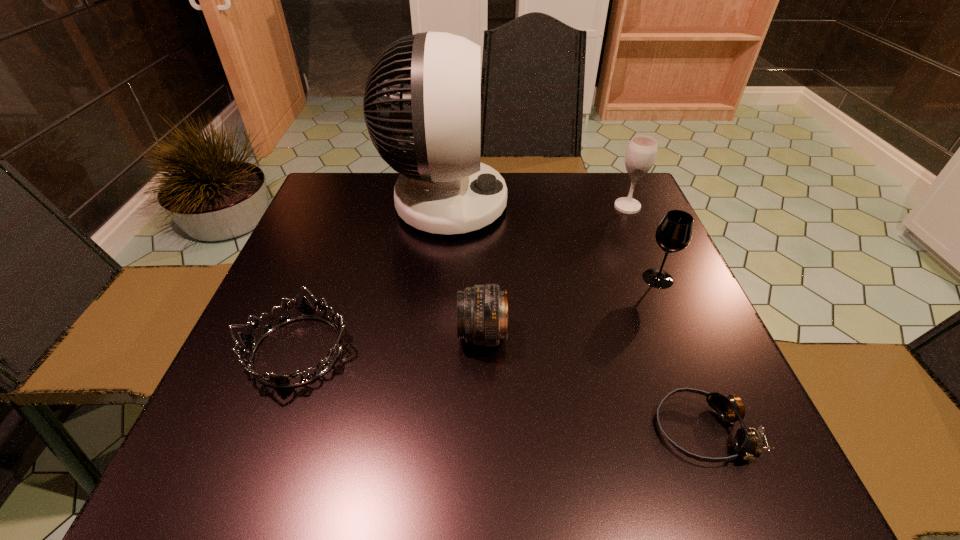
Locate an element on the screen. The height and width of the screenshot is (540, 960). goggles that is positioned at the right edge is located at coordinates (748, 442).

The image size is (960, 540). I want to click on object situated at the far right corner, so click(x=641, y=152).

Identify the location of object at the near right corner. This screenshot has height=540, width=960. (748, 442).

The image size is (960, 540). In the image, there is a desktop. Find the location of `free space at the far edge`. free space at the far edge is located at coordinates (508, 197).

Where is `free space at the near edge of the desktop`? free space at the near edge of the desktop is located at coordinates (621, 462).

Find the location of a particular element. Image resolution: width=960 pixels, height=540 pixels. vacant space at the left edge of the desktop is located at coordinates (309, 332).

I want to click on vacant space at the right edge of the desktop, so pos(645,360).

Identify the location of vacant space at the far left corner of the desktop. This screenshot has height=540, width=960. (359, 217).

Locate an element on the screen. This screenshot has height=540, width=960. free space at the near left corner of the desktop is located at coordinates (224, 453).

Locate an element on the screen. The image size is (960, 540). free region at the near right corner is located at coordinates (681, 444).